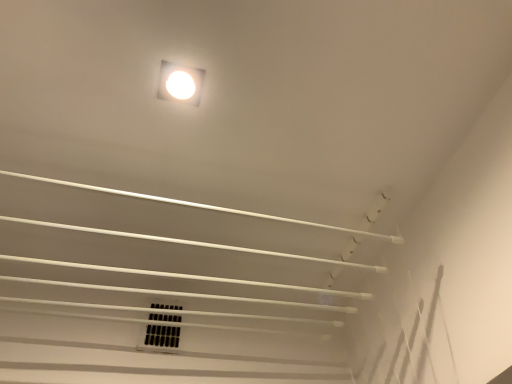
This screenshot has height=384, width=512. Describe the element at coordinates (160, 337) in the screenshot. I see `black plastic vent at center` at that location.

At what (x,y) coordinates should I click in order to perform the action: click on black plastic vent at center. Please return your answer as a coordinate pair (x, y). The width and height of the screenshot is (512, 384). Looking at the image, I should click on (160, 337).

Describe the element at coordinates (180, 83) in the screenshot. The image size is (512, 384). I see `white glossy light fixture at upper center` at that location.

Identify the location of white glossy light fixture at upper center. The width and height of the screenshot is (512, 384). (180, 83).

Identify the location of black plastic vent at center. (160, 337).

Can you confirm if black plastic vent at center is positioned to the right of white glossy light fixture at upper center?

In fact, black plastic vent at center is to the left of white glossy light fixture at upper center.

Considering the relative positions of black plastic vent at center and white glossy light fixture at upper center in the image provided, is black plastic vent at center behind white glossy light fixture at upper center?

Yes, it is.

Does point (145, 330) come behind point (190, 74)?

Yes, it is.

From the image's perspective, which is below, black plastic vent at center or white glossy light fixture at upper center?

From the image's view, black plastic vent at center is below.

From a real-world perspective, is black plastic vent at center below white glossy light fixture at upper center?

Yes, from a real-world perspective, black plastic vent at center is under white glossy light fixture at upper center.

Is black plastic vent at center wider or thinner than white glossy light fixture at upper center?

black plastic vent at center is thinner than white glossy light fixture at upper center.

Considering the sizes of objects black plastic vent at center and white glossy light fixture at upper center in the image provided, who is taller, black plastic vent at center or white glossy light fixture at upper center?

Standing taller between the two is black plastic vent at center.

Can you confirm if black plastic vent at center is smaller than white glossy light fixture at upper center?

Actually, black plastic vent at center might be larger than white glossy light fixture at upper center.

Is black plastic vent at center outside of white glossy light fixture at upper center?

black plastic vent at center is positioned outside white glossy light fixture at upper center.

In the scene shown: Is black plastic vent at center next to white glossy light fixture at upper center?

No, black plastic vent at center is not beside white glossy light fixture at upper center.

Could you tell me if black plastic vent at center is facing white glossy light fixture at upper center?

Yes, black plastic vent at center is turned towards white glossy light fixture at upper center.

What's the angular difference between black plastic vent at center and white glossy light fixture at upper center's facing directions?

There is a 2.12-degree angle between the facing directions of black plastic vent at center and white glossy light fixture at upper center.

You are a GUI agent. You are given a task and a screenshot of the screen. Output one action in this format:
    pyautogui.click(x=<x>, y=<y>)
    Task: Click on the lamp above the black plastic vent at center (from a real-world perspective)
    The width and height of the screenshot is (512, 384).
    Given the screenshot: What is the action you would take?
    pyautogui.click(x=180, y=83)

Considering the relative positions of white glossy light fixture at upper center and black plastic vent at center in the image provided, is white glossy light fixture at upper center to the left of black plastic vent at center from the viewer's perspective?

In fact, white glossy light fixture at upper center is to the right of black plastic vent at center.

Which object is further away from the camera taking this photo, white glossy light fixture at upper center or black plastic vent at center?

black plastic vent at center is more distant.

Which is farther, (x=198, y=97) or (x=174, y=304)?

The point (x=174, y=304) is farther from the camera.

From the image's perspective, between white glossy light fixture at upper center and black plastic vent at center, who is located below?

black plastic vent at center.

From a real-world perspective, between white glossy light fixture at upper center and black plastic vent at center, who is vertically higher?

white glossy light fixture at upper center, from a real-world perspective.

Which object is thinner, white glossy light fixture at upper center or black plastic vent at center?

With smaller width is black plastic vent at center.

Does white glossy light fixture at upper center have a greater height compared to black plastic vent at center?

No, white glossy light fixture at upper center is not taller than black plastic vent at center.

Considering the sizes of objects white glossy light fixture at upper center and black plastic vent at center in the image provided, who is smaller, white glossy light fixture at upper center or black plastic vent at center?

white glossy light fixture at upper center is smaller.

Is black plastic vent at center inside white glossy light fixture at upper center?

Definitely not — black plastic vent at center is not inside white glossy light fixture at upper center.

Is white glossy light fixture at upper center not near black plastic vent at center?

white glossy light fixture at upper center is near black plastic vent at center, not far away.

Is white glossy light fixture at upper center oriented towards black plastic vent at center?

No, white glossy light fixture at upper center is not facing towards black plastic vent at center.

Where is `window located below the white glossy light fixture at upper center (from the image's perspective)`? The width and height of the screenshot is (512, 384). window located below the white glossy light fixture at upper center (from the image's perspective) is located at coordinates (160, 337).

The width and height of the screenshot is (512, 384). What are the coordinates of `lamp that is above the black plastic vent at center (from a real-world perspective)` in the screenshot? It's located at (180, 83).

Find the location of `lamp in front of the black plastic vent at center`. lamp in front of the black plastic vent at center is located at coordinates (180, 83).